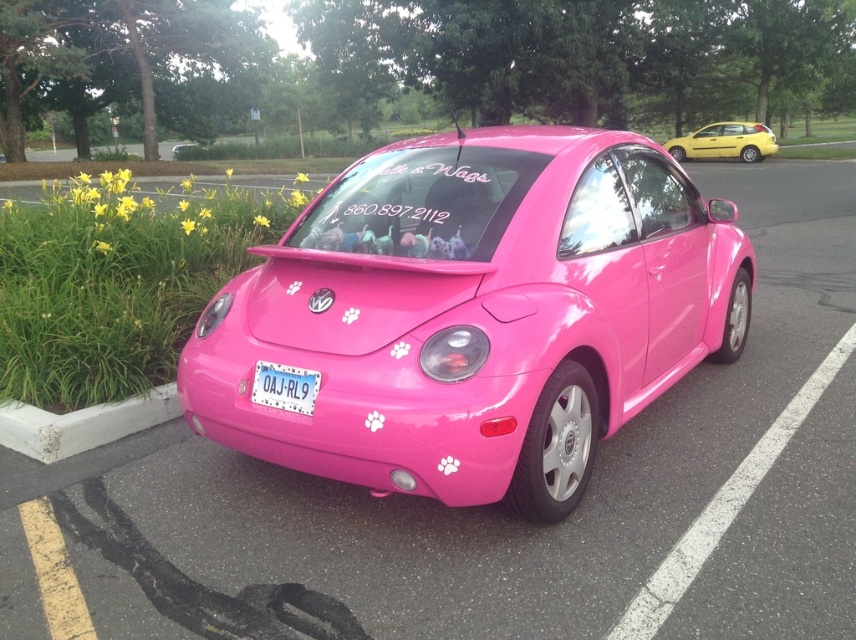
Can you confirm if concrete at lower left is positioned to the left of pink plastic license plate at center?

Indeed, concrete at lower left is positioned on the left side of pink plastic license plate at center.

Does concrete at lower left appear under pink plastic license plate at center?

Yes, concrete at lower left is below pink plastic license plate at center.

Does point (33, 444) lie behind point (311, 390)?

Yes, it is behind point (311, 390).

This screenshot has width=856, height=640. In order to click on concrete at lower left in this screenshot , I will do `click(82, 422)`.

Which of these two, concrete at lower left or yellow matte hatchback at upper right, stands taller?

With more height is yellow matte hatchback at upper right.

Can you confirm if concrete at lower left is smaller than yellow matte hatchback at upper right?

Indeed, concrete at lower left has a smaller size compared to yellow matte hatchback at upper right.

Between point (144, 424) and point (724, 154), which one is positioned in front?

Point (144, 424) is in front.

You are a GUI agent. You are given a task and a screenshot of the screen. Output one action in this format:
    pyautogui.click(x=<x>, y=<y>)
    Task: Click on the concrete at lower left
    The height and width of the screenshot is (640, 856).
    Given the screenshot: What is the action you would take?
    pyautogui.click(x=82, y=422)

I want to click on yellow matte hatchback at upper right, so click(x=724, y=141).

This screenshot has width=856, height=640. Describe the element at coordinates (724, 141) in the screenshot. I see `yellow matte hatchback at upper right` at that location.

Where is `yellow matte hatchback at upper right`? This screenshot has width=856, height=640. yellow matte hatchback at upper right is located at coordinates (724, 141).